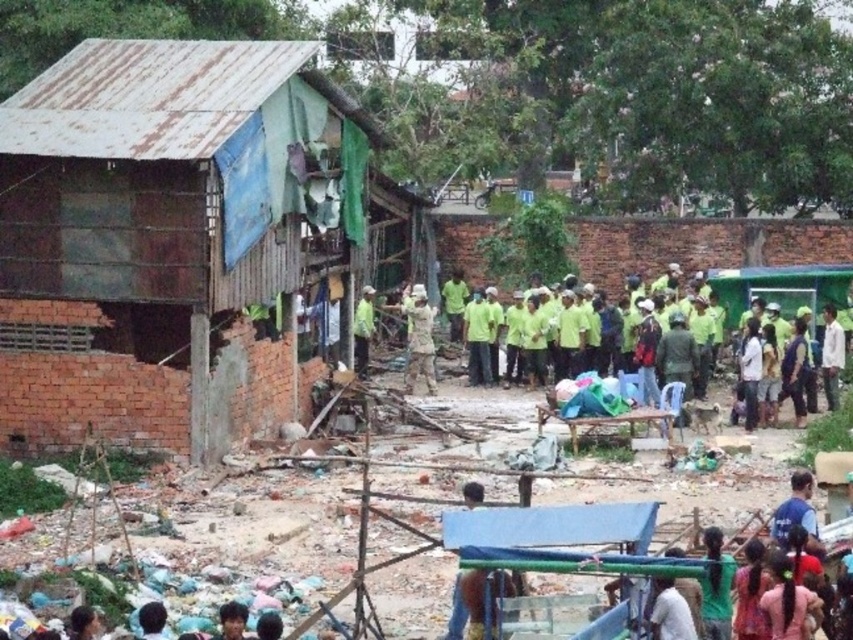
You are a construction worker who just arrived at the site. You need to locate your camouflage fabric uniform at center. Where would you look relative to the debris pile in the foreground?

The camouflage fabric uniform at center is located at the coordinates point (419,339), which is near the center of the image. Since the debris pile is in the foreground, the camouflage fabric uniform at center is likely positioned above or behind the debris pile in the scene.